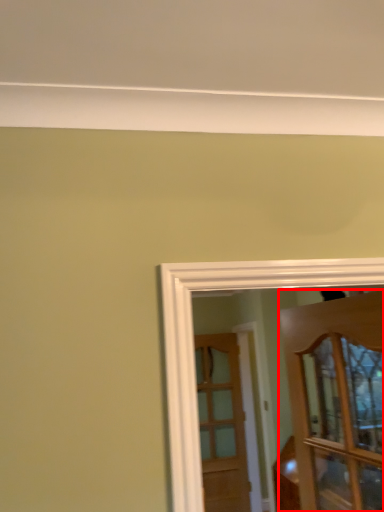
Question: From the image, what is the correct spatial relationship of door (annotated by the red box) in relation to door?

Choices:
 (A) left
 (B) right

Answer: (B)